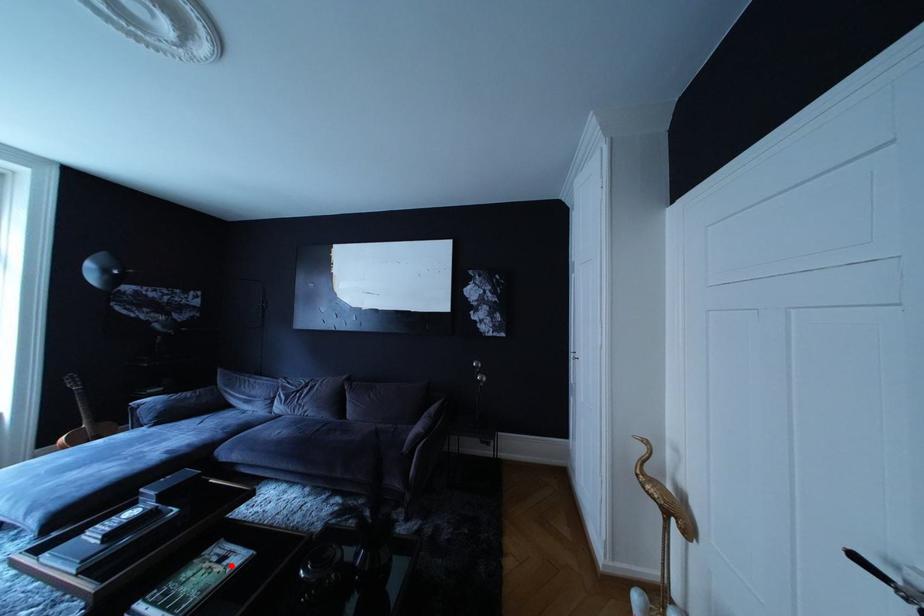
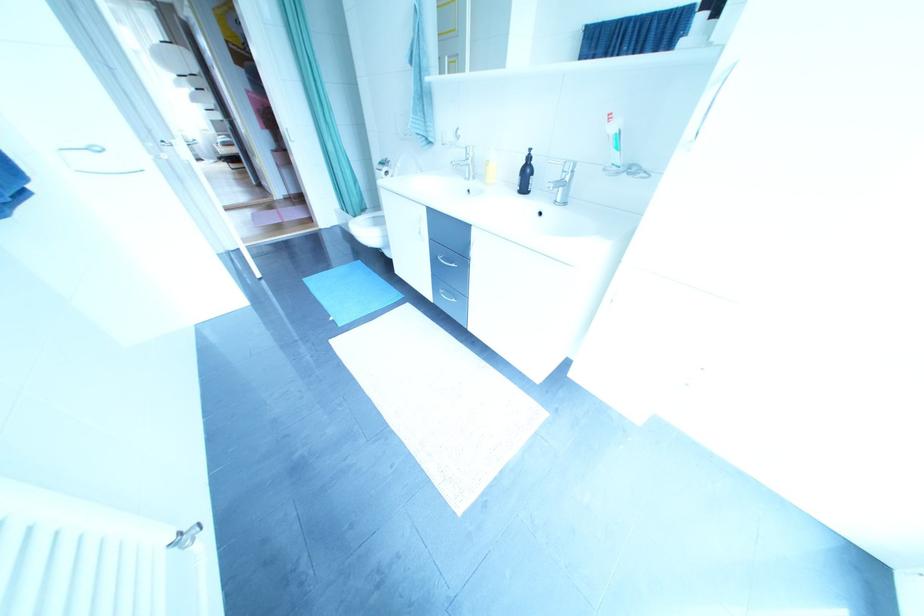
Question: I am providing you with two images of the same scene from different viewpoints. A red point is marked on the first image. At the location where the point appears in image 1, is it still visible in image 2?

Choices:
 (A) Yes
 (B) No

Answer: (B)